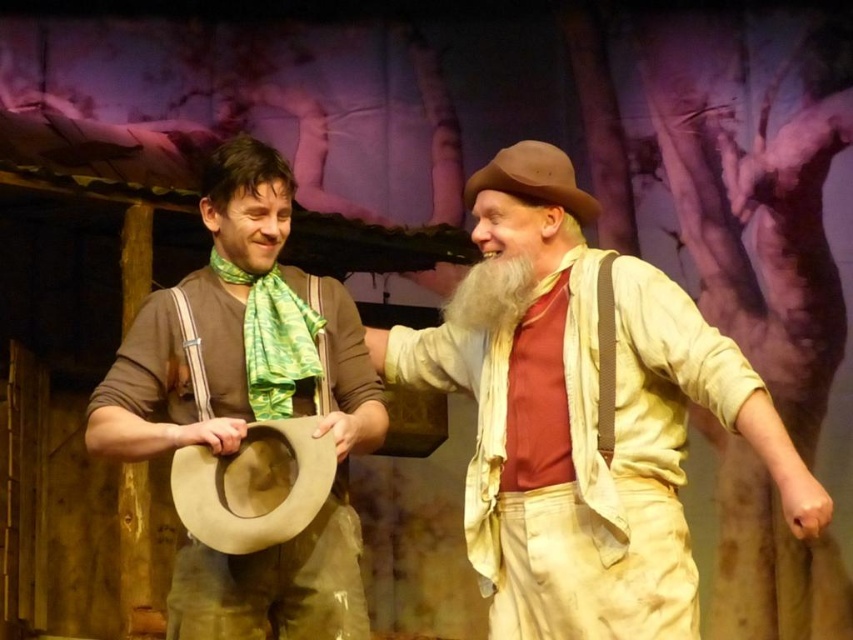
You are an actor positioned at the center of the stage. You need to quickly grab the beige cotton shirt at center during a scene transition. Based on its coordinates, can you estimate how far it is from your current position?

The beige cotton shirt at center is located at point (585, 420), which is slightly to the right and above your current position at the center. You can move diagonally towards those coordinates to reach it efficiently.

You are a stagehand observing the performers on stage. You notice the brown suede cowboy hat at left and the white fluffy beard at center. Which object has a greater height?

The brown suede cowboy hat at left is taller than the white fluffy beard at center.